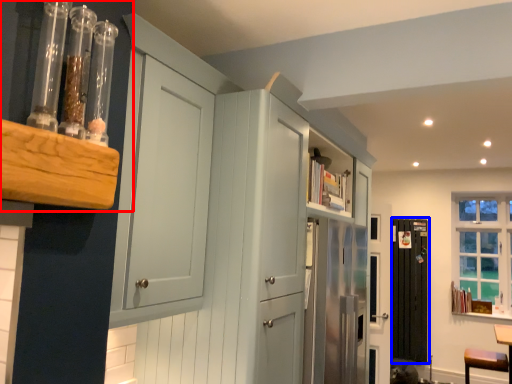
Question: Which of the following is the closest to the observer, shelf (highlighted by a red box) or screen door (highlighted by a blue box)?

Choices:
 (A) shelf
 (B) screen door

Answer: (A)